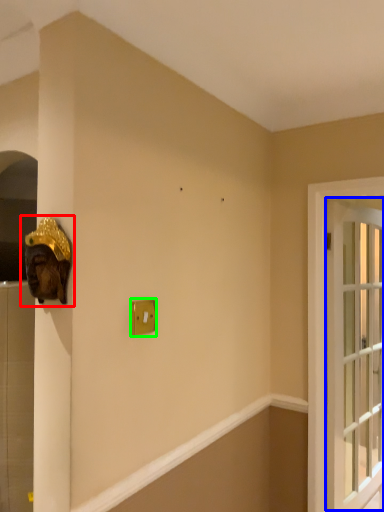
Question: Based on their relative distances, which object is farther from sculpture (highlighted by a red box)? Choose from window (highlighted by a blue box) and light switch (highlighted by a green box).

Choices:
 (A) window
 (B) light switch

Answer: (A)